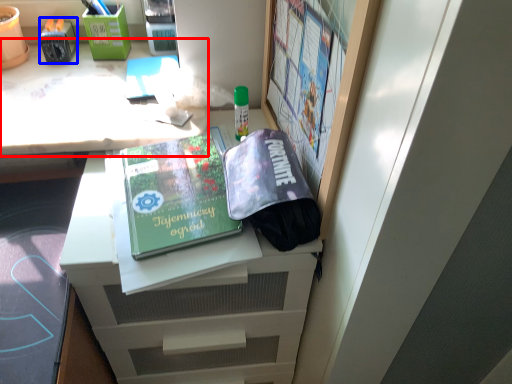
Question: Which object appears farthest to the camera in this image, desk (highlighted by a red box) or stationery (highlighted by a blue box)?

Choices:
 (A) desk
 (B) stationery

Answer: (B)